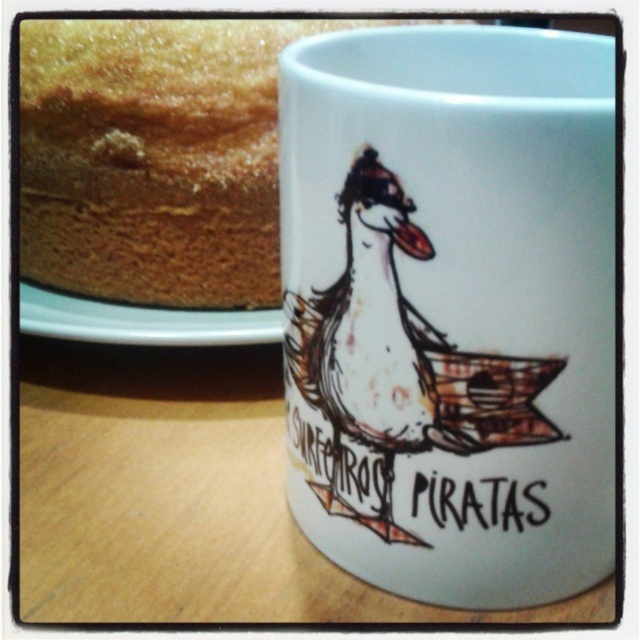
Question: Can you confirm if wooden table at lower center is wider than golden brown sponge cake at upper left?

Choices:
 (A) no
 (B) yes

Answer: (B)

Question: Is white matte mug at upper center positioned behind wooden table at lower center?

Choices:
 (A) no
 (B) yes

Answer: (A)

Question: Considering the real-world distances, which object is farthest from the white matte mug at upper center?

Choices:
 (A) wooden table at lower center
 (B) golden brown sponge cake at upper left

Answer: (B)

Question: Which of the following is the closest to the observer?

Choices:
 (A) (410, 468)
 (B) (262, 604)
 (C) (163, 308)

Answer: (A)

Question: Which point appears closest to the camera in this image?

Choices:
 (A) (256, 252)
 (B) (611, 588)

Answer: (B)

Question: In this image, where is white matte mug at upper center located relative to white glossy plate at upper left?

Choices:
 (A) right
 (B) left

Answer: (A)